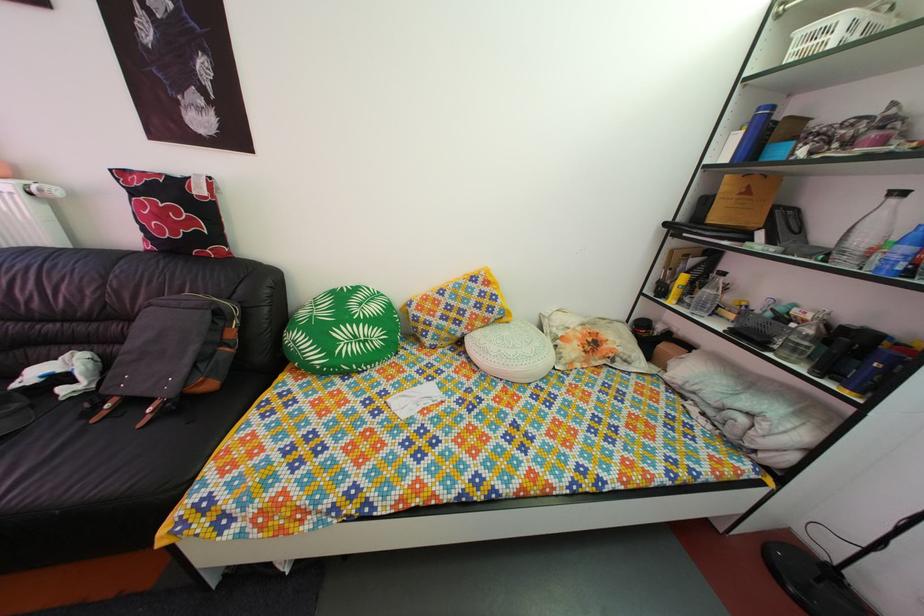
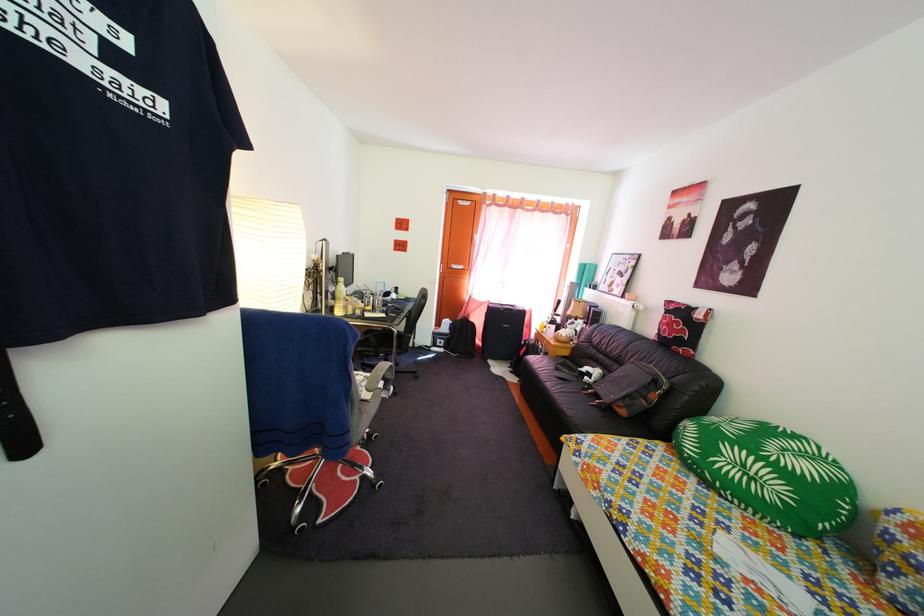
Question: The camera is either moving clockwise (left) or counter-clockwise (right) around the object. The first image is from the beginning of the video and the second image is from the end. Is the camera moving left or right when shooting the video?

Choices:
 (A) Left
 (B) Right

Answer: (B)